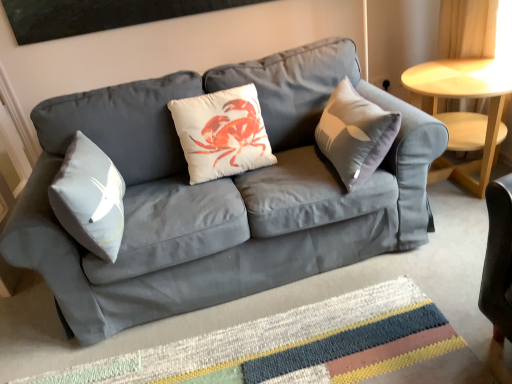
Question: Is multicolored woven mat at center oriented towards matte gray couch at center?

Choices:
 (A) no
 (B) yes

Answer: (B)

Question: Is there a large distance between multicolored woven mat at center and matte gray couch at center?

Choices:
 (A) no
 (B) yes

Answer: (A)

Question: Does multicolored woven mat at center come behind matte gray couch at center?

Choices:
 (A) yes
 (B) no

Answer: (B)

Question: Does multicolored woven mat at center appear on the left side of matte gray couch at center?

Choices:
 (A) no
 (B) yes

Answer: (A)

Question: From a real-world perspective, does multicolored woven mat at center stand above matte gray couch at center?

Choices:
 (A) no
 (B) yes

Answer: (A)

Question: Is point (106, 379) closer or farther from the camera than point (470, 77)?

Choices:
 (A) farther
 (B) closer

Answer: (B)

Question: Is multicolored woven mat at center taller or shorter than light wood/finished table at right?

Choices:
 (A) tall
 (B) short

Answer: (B)

Question: Considering the positions of multicolored woven mat at center and light wood/finished table at right in the image, is multicolored woven mat at center bigger or smaller than light wood/finished table at right?

Choices:
 (A) small
 (B) big

Answer: (A)

Question: From the image's perspective, relative to light wood/finished table at right, is multicolored woven mat at center above or below?

Choices:
 (A) below
 (B) above

Answer: (A)

Question: From their relative heights in the image, would you say light wood/finished table at right is taller or shorter than white matte cushion at center?

Choices:
 (A) tall
 (B) short

Answer: (B)

Question: In the image, is light wood/finished table at right on the left side or the right side of white matte cushion at center?

Choices:
 (A) left
 (B) right

Answer: (B)

Question: Relative to white matte cushion at center, is light wood/finished table at right in front or behind?

Choices:
 (A) front
 (B) behind

Answer: (B)

Question: Considering the positions of light wood/finished table at right and white matte cushion at center in the image, is light wood/finished table at right wider or thinner than white matte cushion at center?

Choices:
 (A) wide
 (B) thin

Answer: (A)

Question: Relative to matte gray couch at center, is white matte cushion at center in front or behind?

Choices:
 (A) behind
 (B) front

Answer: (A)

Question: From the image's perspective, is white matte cushion at center positioned above or below matte gray couch at center?

Choices:
 (A) above
 (B) below

Answer: (A)